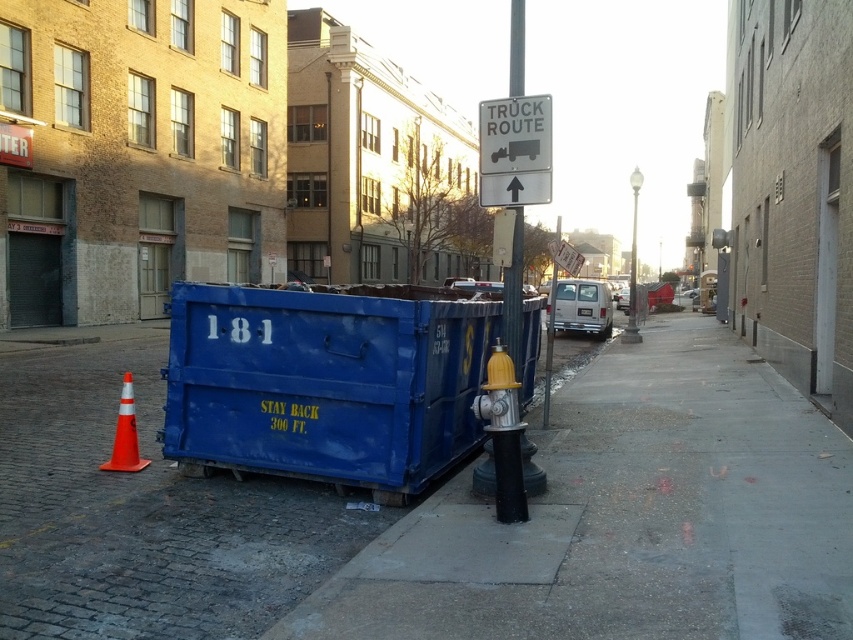
Is metallic pole at center wider than orange reflective cone at lower left?

Indeed, metallic pole at center has a greater width compared to orange reflective cone at lower left.

Is metallic pole at center above orange reflective cone at lower left?

Correct, metallic pole at center is located above orange reflective cone at lower left.

At what (x,y) coordinates should I click in order to perform the action: click on metallic pole at center. Please return your answer as a coordinate pair (x, y). The image size is (853, 640). Looking at the image, I should click on (514, 296).

Does blue plastic container at center have a greater width compared to orange reflective cone at lower left?

Correct, the width of blue plastic container at center exceeds that of orange reflective cone at lower left.

At what (x,y) coordinates should I click in order to perform the action: click on blue plastic container at center. Please return your answer as a coordinate pair (x, y). The height and width of the screenshot is (640, 853). Looking at the image, I should click on (326, 381).

Who is more distant from viewer, (183, 362) or (115, 465)?

Positioned behind is point (115, 465).

Locate an element on the screen. This screenshot has height=640, width=853. blue plastic container at center is located at coordinates (326, 381).

Is point (253, 420) in front of point (537, 472)?

No, (253, 420) is further to viewer.

Where is `blue plastic container at center`? Image resolution: width=853 pixels, height=640 pixels. blue plastic container at center is located at coordinates (326, 381).

Find the location of a particular element. The height and width of the screenshot is (640, 853). blue plastic container at center is located at coordinates (326, 381).

The image size is (853, 640). In order to click on blue plastic container at center in this screenshot , I will do `click(326, 381)`.